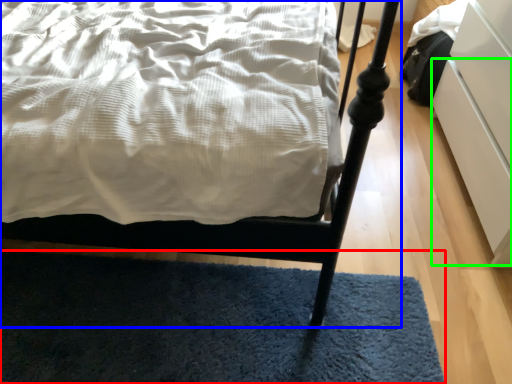
Question: Which is nearer to the mat (highlighted by a red box)? bed (highlighted by a blue box) or drawer (highlighted by a green box).

Choices:
 (A) bed
 (B) drawer

Answer: (A)